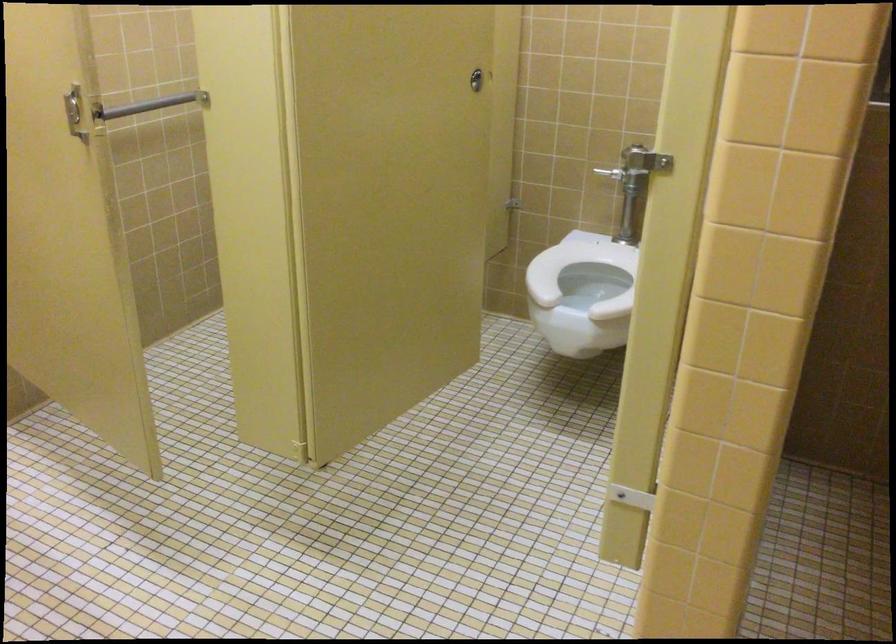
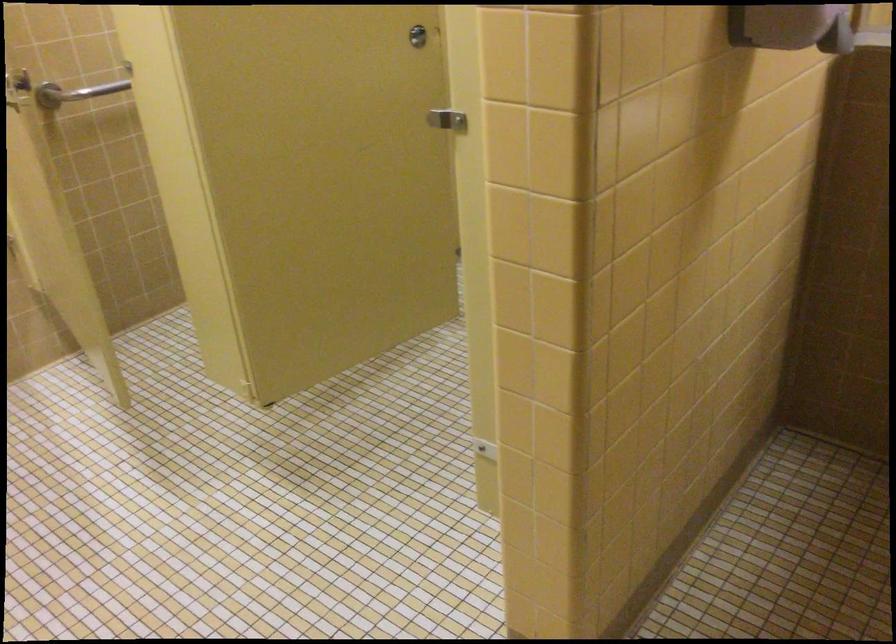
Find the pixel in the second image that matches point (648, 149) in the first image.

(446, 120)